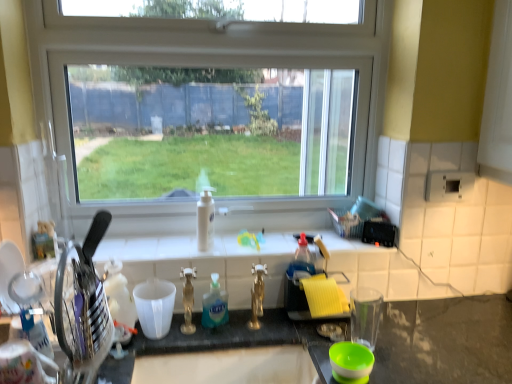
You are a GUI agent. You are given a task and a screenshot of the screen. Output one action in this format:
    pyautogui.click(x=<x>, y=<y>)
    Task: Click on the vacant space behind white glossy bottle at center, which is counted as the first bottle, starting from the back
    The image size is (512, 384).
    Given the screenshot: What is the action you would take?
    pyautogui.click(x=205, y=242)